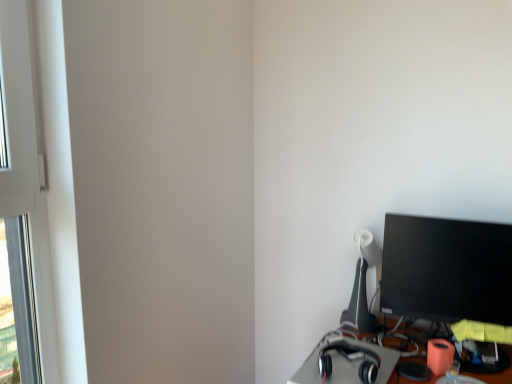
What do you see at coordinates (365, 354) in the screenshot?
I see `satin black headphones at lower right` at bounding box center [365, 354].

Locate an element on the screen. matte black table lamp at right is located at coordinates (361, 286).

Where is `black glossy monitor at right`? The width and height of the screenshot is (512, 384). black glossy monitor at right is located at coordinates (446, 269).

Between point (368, 354) and point (32, 191), which one is positioned in front?

The point (32, 191) is closer to the camera.

I want to click on window frame above the satin black headphones at lower right (from a real-world perspective), so click(x=27, y=163).

From the image's perspective, is black glossy monitor at right above white plastic window frame at left?

No, from the image's perspective, black glossy monitor at right is not over white plastic window frame at left.

Where is `window frame located on the left of black glossy monitor at right`? window frame located on the left of black glossy monitor at right is located at coordinates (27, 163).

Considering the relative sizes of black glossy monitor at right and white plastic window frame at left in the image provided, is black glossy monitor at right wider than white plastic window frame at left?

Indeed, black glossy monitor at right has a greater width compared to white plastic window frame at left.

Looking at this image, is black glossy monitor at right not close to satin black headphones at lower right?

No.

Is black glossy monitor at right not within satin black headphones at lower right?

Absolutely, black glossy monitor at right is external to satin black headphones at lower right.

I want to click on computer monitor behind the satin black headphones at lower right, so click(446, 269).

Which point is more distant from viewer, (x=33, y=247) or (x=389, y=356)?

Positioned behind is point (x=389, y=356).

Between white plastic window frame at left and satin black headphones at lower right, which one has smaller size?

Smaller between the two is satin black headphones at lower right.

Does white plastic window frame at left come behind satin black headphones at lower right?

No, white plastic window frame at left is closer to the viewer.

Who is taller, white plastic window frame at left or satin black headphones at lower right?

Standing taller between the two is white plastic window frame at left.

Is white plastic window frame at left oriented away from black glossy monitor at right?

No, white plastic window frame at left's orientation is not away from black glossy monitor at right.

How much distance is there between white plastic window frame at left and black glossy monitor at right?

1.15 meters.

Is white plastic window frame at left beside black glossy monitor at right?

white plastic window frame at left and black glossy monitor at right are not in contact.

Considering the sizes of objects white plastic window frame at left and black glossy monitor at right in the image provided, who is taller, white plastic window frame at left or black glossy monitor at right?

With more height is white plastic window frame at left.

Considering their positions, is black glossy monitor at right located in front of or behind matte black table lamp at right?

Clearly, black glossy monitor at right is in front of matte black table lamp at right.

Looking at the image, does black glossy monitor at right seem bigger or smaller compared to matte black table lamp at right?

In the image, black glossy monitor at right appears to be larger than matte black table lamp at right.

Between black glossy monitor at right and matte black table lamp at right, which one has more height?

Standing taller between the two is matte black table lamp at right.

Is matte black table lamp at right turned away from satin black headphones at lower right?

matte black table lamp at right is not turned away from satin black headphones at lower right.

Is the depth of matte black table lamp at right greater than that of satin black headphones at lower right?

Yes, matte black table lamp at right is further from the camera.

Is matte black table lamp at right shorter than satin black headphones at lower right?

Incorrect, the height of matte black table lamp at right does not fall short of that of satin black headphones at lower right.

What's the angular difference between matte black table lamp at right and satin black headphones at lower right's facing directions?

The facing directions of matte black table lamp at right and satin black headphones at lower right are 16 degrees apart.

Image resolution: width=512 pixels, height=384 pixels. Identify the location of headphones behind the white plastic window frame at left. (365, 354).

Identify the location of window frame that is above the black glossy monitor at right (from the image's perspective). Image resolution: width=512 pixels, height=384 pixels. (27, 163).

Considering their positions, is white plastic window frame at left positioned further to matte black table lamp at right than satin black headphones at lower right?

Among the two, white plastic window frame at left is located further to matte black table lamp at right.

From the image, which object appears to be farther from satin black headphones at lower right, black glossy monitor at right or white plastic window frame at left?

white plastic window frame at left.

When comparing their distances from matte black table lamp at right, does white plastic window frame at left or black glossy monitor at right seem closer?

Based on the image, black glossy monitor at right appears to be nearer to matte black table lamp at right.

Based on their spatial positions, is white plastic window frame at left or matte black table lamp at right further from satin black headphones at lower right?

The object further to satin black headphones at lower right is white plastic window frame at left.

Looking at the image, which one is located closer to white plastic window frame at left, black glossy monitor at right or matte black table lamp at right?

The object closer to white plastic window frame at left is matte black table lamp at right.

Looking at the image, which one is located closer to matte black table lamp at right, satin black headphones at lower right or white plastic window frame at left?

satin black headphones at lower right is closer to matte black table lamp at right.

From the image, which object appears to be nearer to black glossy monitor at right, satin black headphones at lower right or white plastic window frame at left?

The object closer to black glossy monitor at right is satin black headphones at lower right.

From the image, which object appears to be farther from black glossy monitor at right, white plastic window frame at left or matte black table lamp at right?

white plastic window frame at left.

Identify the location of headphones between white plastic window frame at left and black glossy monitor at right in the horizontal direction. (365, 354).

The width and height of the screenshot is (512, 384). I want to click on headphones between white plastic window frame at left and matte black table lamp at right in the horizontal direction, so click(x=365, y=354).

The width and height of the screenshot is (512, 384). Find the location of `table lamp between satin black headphones at lower right and black glossy monitor at right from left to right`. table lamp between satin black headphones at lower right and black glossy monitor at right from left to right is located at coordinates coord(361,286).

The height and width of the screenshot is (384, 512). Find the location of `table lamp located between white plastic window frame at left and black glossy monitor at right in the left-right direction`. table lamp located between white plastic window frame at left and black glossy monitor at right in the left-right direction is located at coordinates (361, 286).